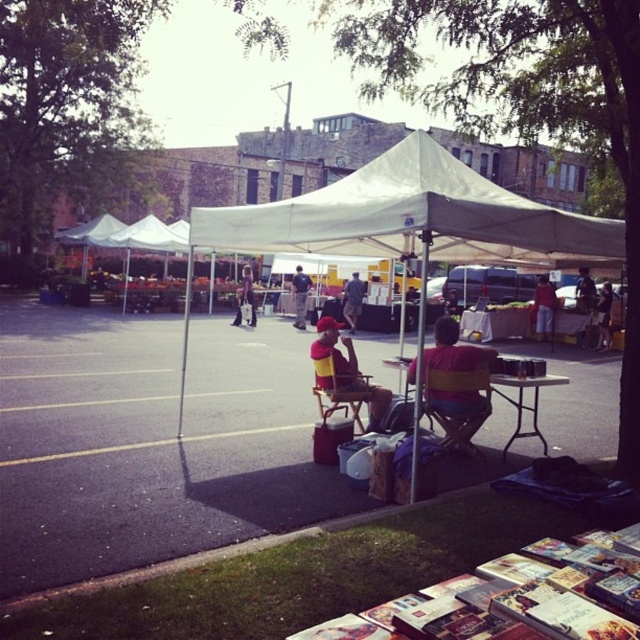
You are standing at the entrance of the market under the canopy. There are two points marked in the scene. Which point is closer to you, point (352,317) or point (236,324)?

Point (352,317) is closer to you because it is further to the viewer than point (236,324).

What is the location of the point at coordinates (413, 218) in the outdoor market scene?

The point at coordinates (413, 218) is located on the white fabric canopy at center.